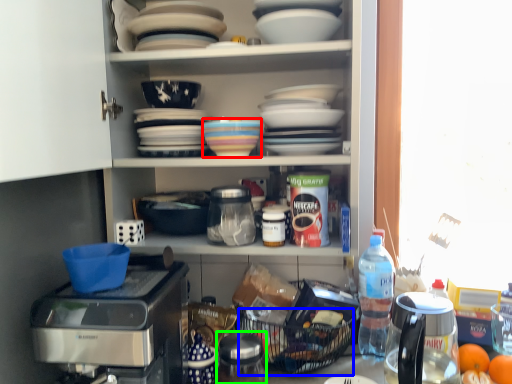
Question: Which object is the closest to the tableware (highlighted by a red box)? Choose among these: basket (highlighted by a blue box) or appliance (highlighted by a green box).

Choices:
 (A) basket
 (B) appliance

Answer: (A)